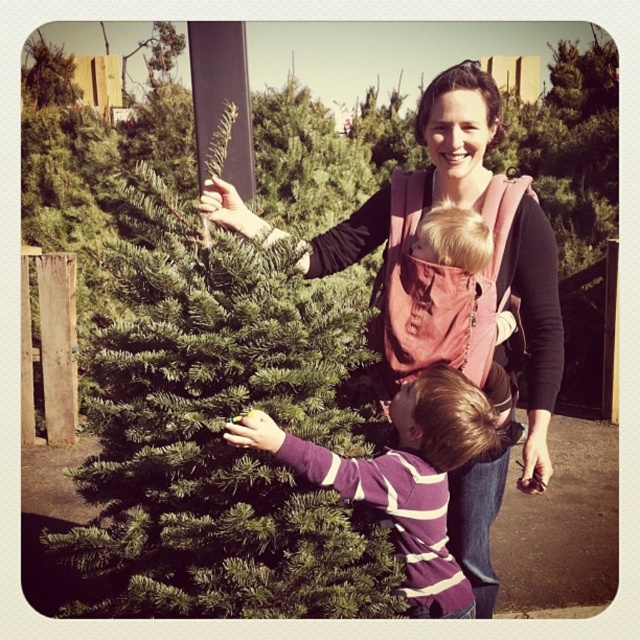
You are a photographer positioned at the front of the scene. You want to take a photo that includes both the green matte christmas tree at left and the pink fabric carrier at center. Which object should you focus on first to ensure both are in sharp focus?

The green matte christmas tree at left is closer to the viewer than the pink fabric carrier at center, so you should focus on the green matte christmas tree at left first to ensure both are in sharp focus.

You are a photographer standing in the Christmas tree farm scene. You want to take a photo of the green matte christmas tree at left and the purple striped sweater at center. Based on their positions, which object should you frame first in your camera viewfinder to ensure both are in the shot?

The green matte christmas tree at left should be framed first since it is positioned to the left of the purple striped sweater at center, so starting with the tree ensures both objects are included in the frame.

You are a photographer trying to capture a closeup of the pink fabric carrier at center and the purple striped sweater at center in the scene. What is the minimum distance you need to set your camera lens to focus on both objects clearly?

The minimum distance your camera lens needs to focus on both the pink fabric carrier at center and the purple striped sweater at center clearly is 15.96 inches, as they are positioned 15.96 inches apart.